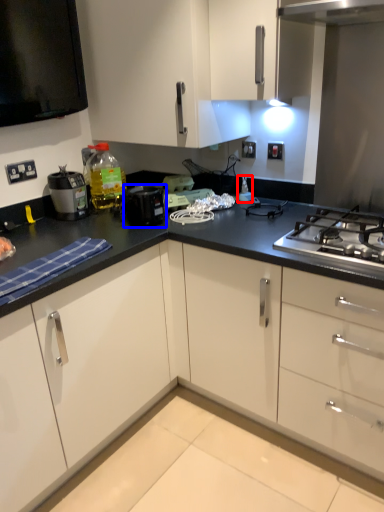
Question: Which object appears farthest to the camera in this image, appliance (highlighted by a red box) or kitchen appliance (highlighted by a blue box)?

Choices:
 (A) appliance
 (B) kitchen appliance

Answer: (A)